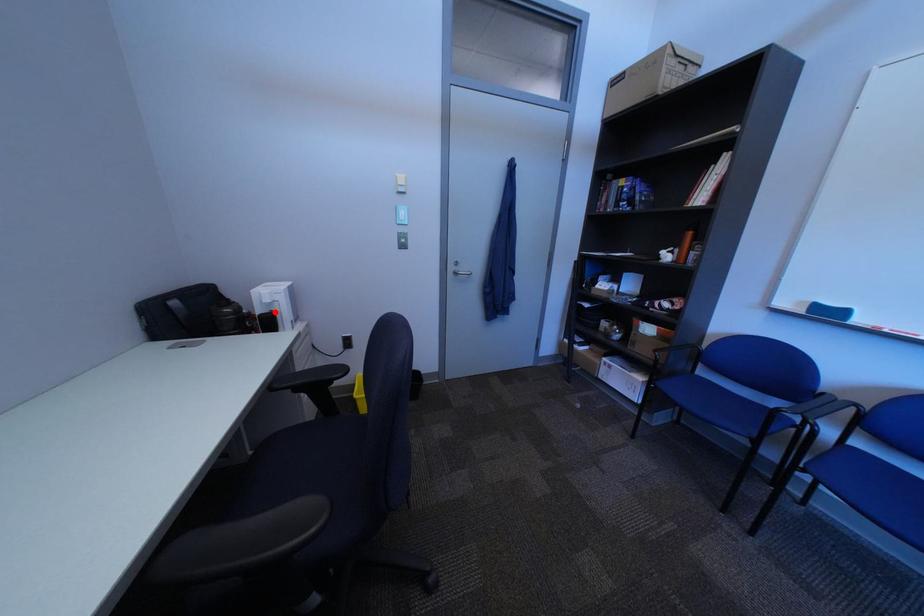
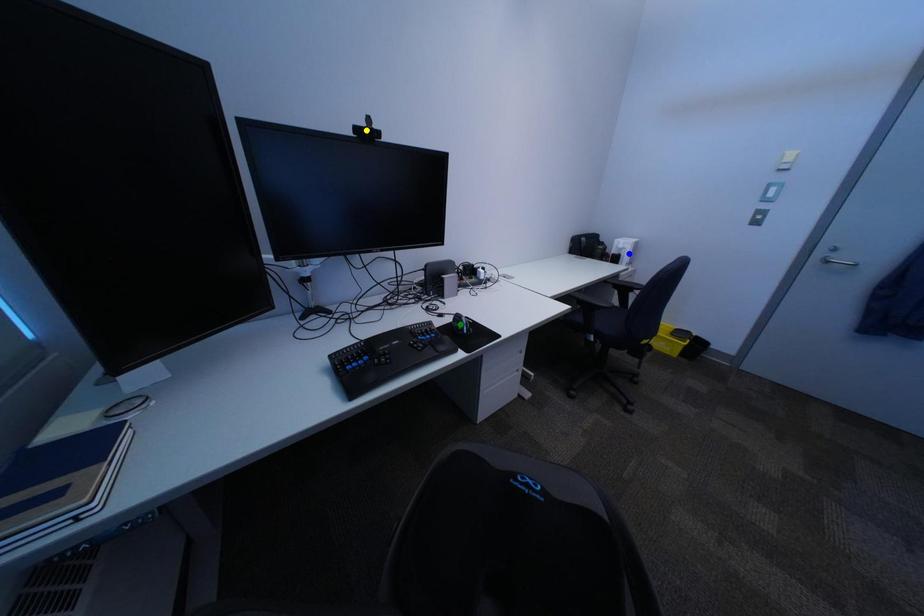
Question: I am providing you with two images of the same scene from different viewpoints. A red point is marked on the first image. You are given multiple points on the second image. Which mark in image 2 goes with the point in image 1?

Choices:
 (A) yellow point
 (B) blue point
 (C) green point

Answer: (B)